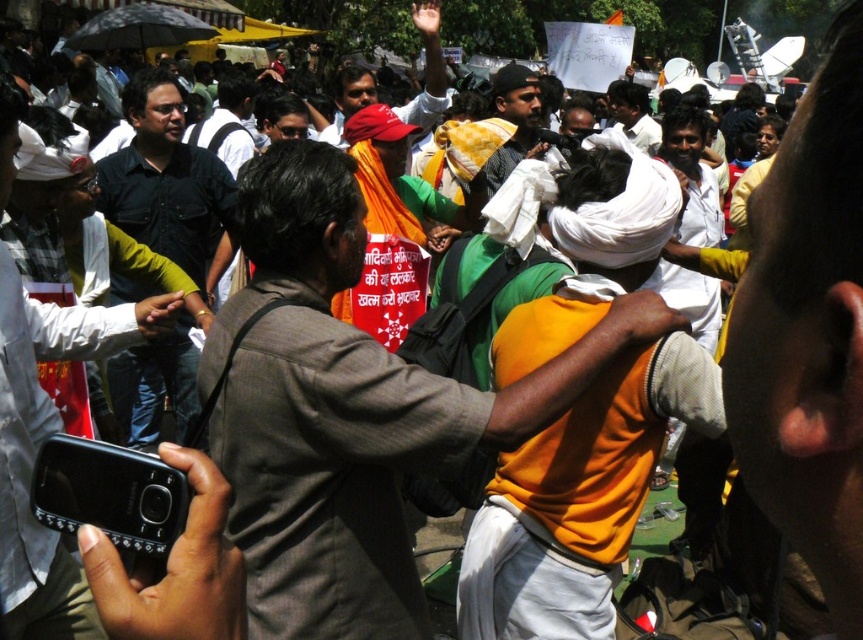
Who is more forward, [492,426] or [822,209]?

Point [822,209] is in front.

Is orange fabric shirt at center bigger than matte black phone at center?

Actually, orange fabric shirt at center might be smaller than matte black phone at center.

Who is more forward, (565, 401) or (728, 433)?

Point (728, 433) is more forward.

You are a GUI agent. You are given a task and a screenshot of the screen. Output one action in this format:
    pyautogui.click(x=<x>, y=<y>)
    Task: Click on the orange fabric shirt at center
    Image resolution: width=863 pixels, height=640 pixels.
    Given the screenshot: What is the action you would take?
    pyautogui.click(x=350, y=412)

Is point (778, 161) positioned behind point (211, 188)?

No, it is not.

Does point (829, 52) lie in front of point (126, 413)?

Yes, it is.

This screenshot has height=640, width=863. Identify the location of matte black phone at center. (808, 340).

I want to click on matte black phone at center, so click(x=808, y=340).

Does orange cotton shirt at center lie in front of matte black shirt at left?

No, orange cotton shirt at center is behind matte black shirt at left.

Between orange cotton shirt at center and matte black shirt at left, which one appears on the right side from the viewer's perspective?

orange cotton shirt at center is more to the right.

Which is in front, point (540, 584) or point (11, 141)?

Point (11, 141) is more forward.

Identify the location of orange cotton shirt at center. Image resolution: width=863 pixels, height=640 pixels. (578, 499).